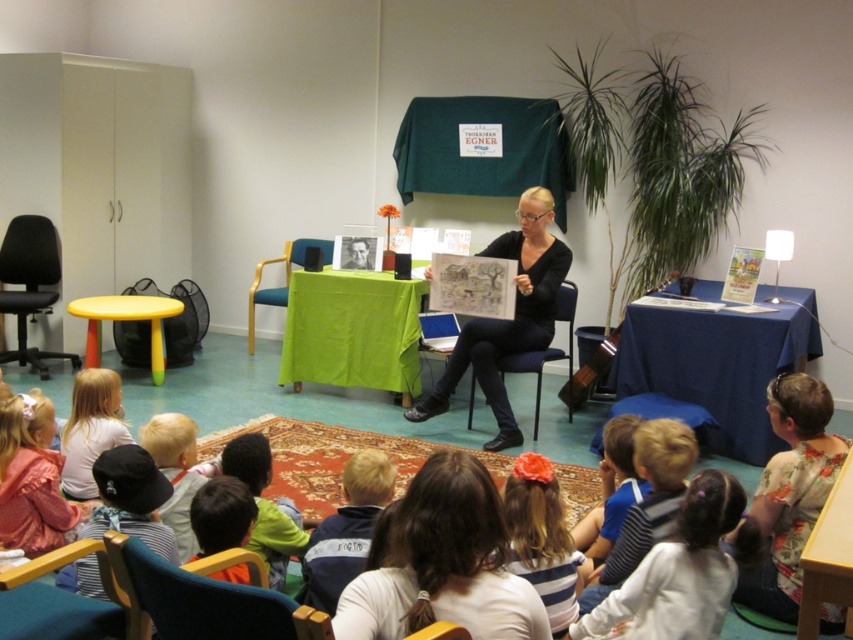
You are a photographer trying to capture the storyteller and the children in the scene. You notice the smooth brown hair at center and the black fabric chair at left. Which object is positioned lower in the image?

The smooth brown hair at center is located below the black fabric chair at left, so it is positioned lower in the image.

In the scene shown: You are a photographer standing in the storytelling session room. You want to take a closeup photo of the white fabric hairband at lower right without moving any objects. Is it possible to do so from your current position?

The white fabric hairband at lower right is 1.97 meters away from the viewer, so yes, you can take a closeup photo of it without moving any objects as long as your camera has sufficient zoom capability.